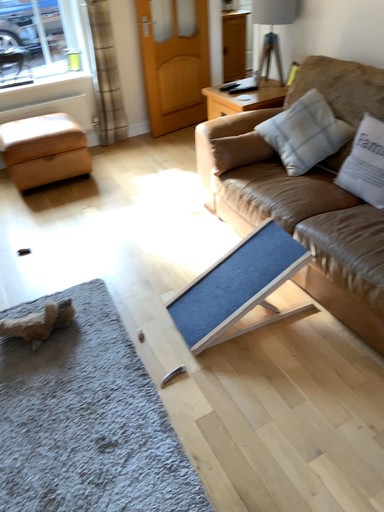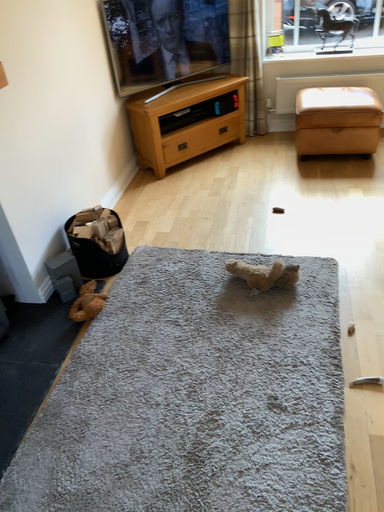
Question: How did the camera likely rotate when shooting the video?

Choices:
 (A) rotated left
 (B) rotated right

Answer: (A)